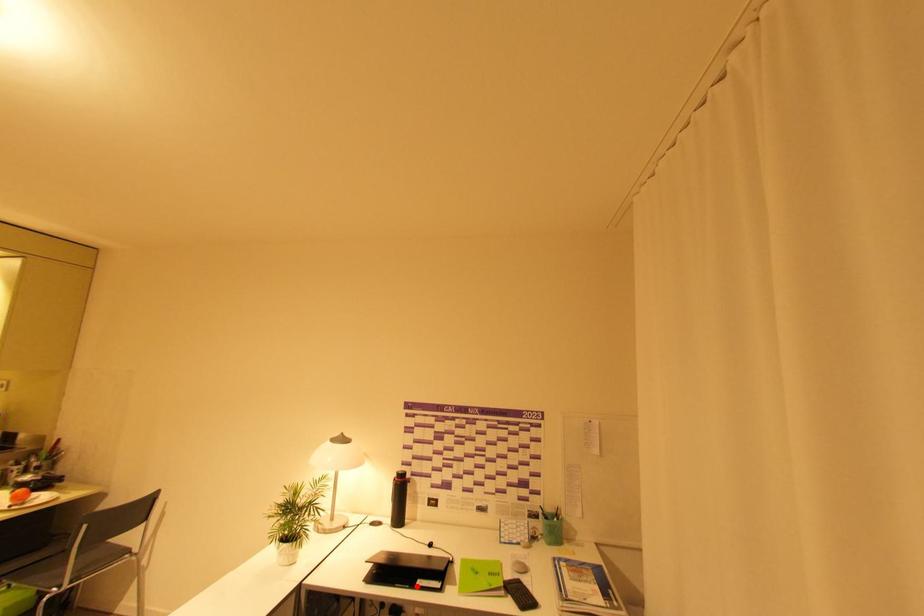
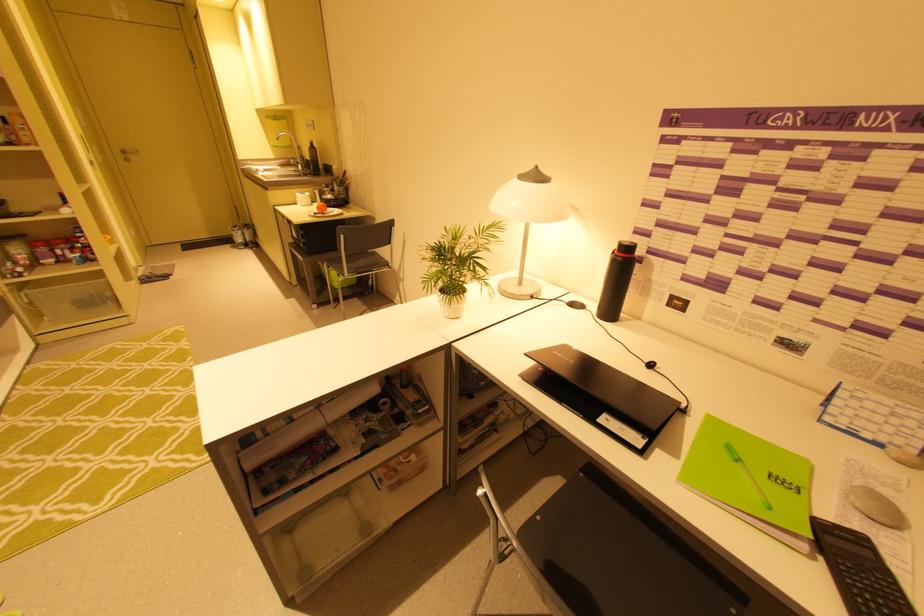
Find the pixel in the second image that matches the highlighted location in the first image.

(596, 419)